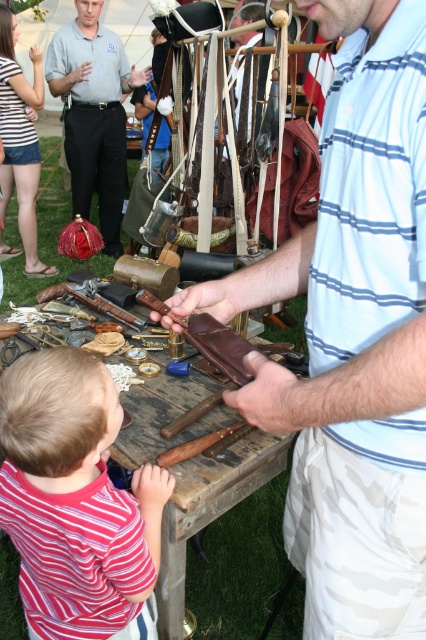
You are standing 40 inches away from the point at the coordinates point (49, 448). Can you reach it without moving your feet?

The distance of point (49, 448) from viewer is 37.19 inches, so yes, you can reach it without moving your feet since you are only 40 inches away.

You are a photographer standing in front of the wooden table at center and the matte black shirt at upper left. Which object is nearer to your camera lens?

The wooden table at center is closer to the viewer than the matte black shirt at upper left, so the wooden table at center is nearer to your camera lens.

You are a photographer at the event and want to take a photo of both the striped shirt at lower left and the matte black shirt at upper left. Which shirt should you focus on first to ensure both are in sharp focus?

You should focus on the striped shirt at lower left first because it is closer to the viewer than the matte black shirt at upper left, so adjusting focus from near to far will help both be in focus.